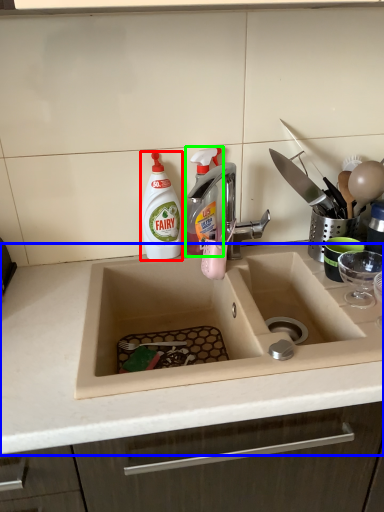
Question: Estimate the real-world distances between objects in this image. Which object is closer to cleaning product (highlighted by a red box), countertop (highlighted by a blue box) or cleaning product (highlighted by a green box)?

Choices:
 (A) countertop
 (B) cleaning product

Answer: (B)